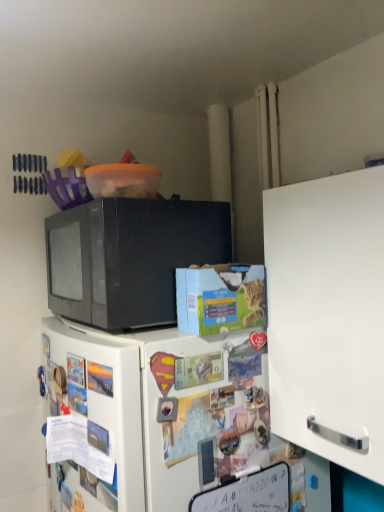
Question: From the image's perspective, is white matte refrigerator at center located beneath black matte microwave at upper left?

Choices:
 (A) no
 (B) yes

Answer: (B)

Question: Is white matte refrigerator at center at the left side of black matte microwave at upper left?

Choices:
 (A) no
 (B) yes

Answer: (A)

Question: Is white matte refrigerator at center not close to black matte microwave at upper left?

Choices:
 (A) yes
 (B) no

Answer: (B)

Question: Does white matte refrigerator at center have a smaller size compared to black matte microwave at upper left?

Choices:
 (A) no
 (B) yes

Answer: (A)

Question: Is the position of white matte refrigerator at center more distant than that of black matte microwave at upper left?

Choices:
 (A) no
 (B) yes

Answer: (A)

Question: In the image, is black matte microwave at upper left positioned in front of or behind white matte cabinet at right?

Choices:
 (A) front
 (B) behind

Answer: (B)

Question: From their relative heights in the image, would you say black matte microwave at upper left is taller or shorter than white matte cabinet at right?

Choices:
 (A) short
 (B) tall

Answer: (A)

Question: Is black matte microwave at upper left to the left or to the right of white matte cabinet at right in the image?

Choices:
 (A) left
 (B) right

Answer: (A)

Question: From a real-world perspective, is black matte microwave at upper left positioned above or below white matte cabinet at right?

Choices:
 (A) above
 (B) below

Answer: (A)

Question: Considering their positions, is black matte microwave at upper left located in front of or behind white matte refrigerator at center?

Choices:
 (A) behind
 (B) front

Answer: (A)

Question: Would you say black matte microwave at upper left is inside or outside white matte refrigerator at center?

Choices:
 (A) inside
 (B) outside

Answer: (B)

Question: From the image's perspective, is black matte microwave at upper left located above or below white matte refrigerator at center?

Choices:
 (A) above
 (B) below

Answer: (A)

Question: Is point (147, 308) closer or farther from the camera than point (213, 408)?

Choices:
 (A) farther
 (B) closer

Answer: (A)

Question: Is white matte cabinet at right inside the boundaries of white matte refrigerator at center, or outside?

Choices:
 (A) outside
 (B) inside

Answer: (A)

Question: From their relative heights in the image, would you say white matte cabinet at right is taller or shorter than white matte refrigerator at center?

Choices:
 (A) short
 (B) tall

Answer: (A)